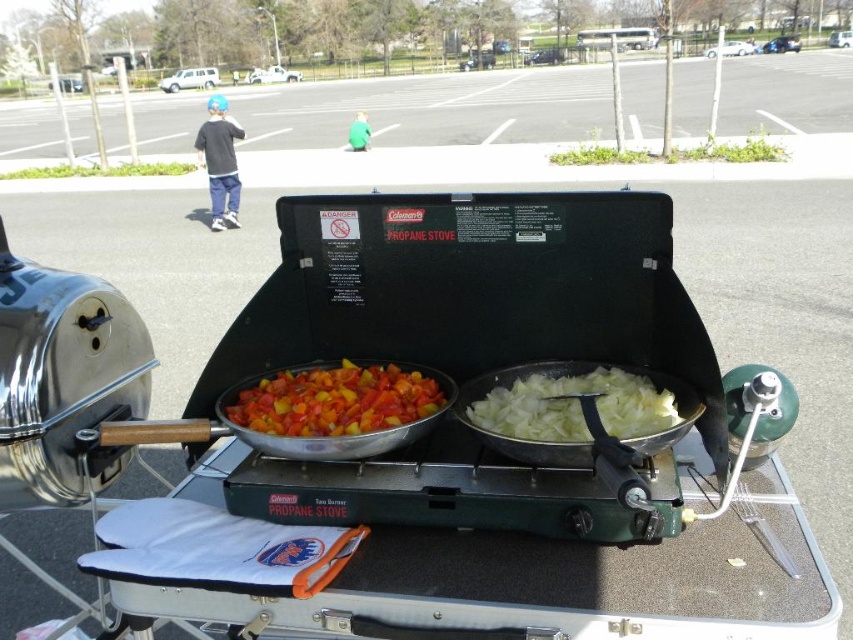
Question: Which of the following is the farthest from the observer?

Choices:
 (A) (610, 372)
 (B) (252, 429)

Answer: (A)

Question: Which point is farther to the camera?

Choices:
 (A) vividly colored vegetables at center
 (B) white translucent onions at right

Answer: (A)

Question: Among these objects, which one is farthest from the camera?

Choices:
 (A) white translucent onions at right
 (B) vividly colored vegetables at center

Answer: (B)

Question: Is vividly colored vegetables at center above white translucent onions at right?

Choices:
 (A) no
 (B) yes

Answer: (A)

Question: Does vividly colored vegetables at center have a smaller size compared to white translucent onions at right?

Choices:
 (A) no
 (B) yes

Answer: (A)

Question: Can you confirm if vividly colored vegetables at center is thinner than white translucent onions at right?

Choices:
 (A) no
 (B) yes

Answer: (A)